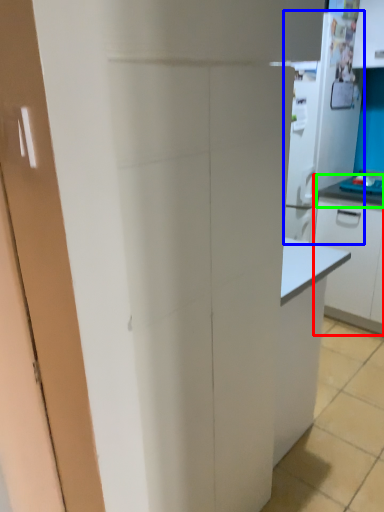
Question: Which is nearer to the cabinetry (highlighted by a red box)? appliance (highlighted by a blue box) or countertop (highlighted by a green box).

Choices:
 (A) appliance
 (B) countertop

Answer: (B)